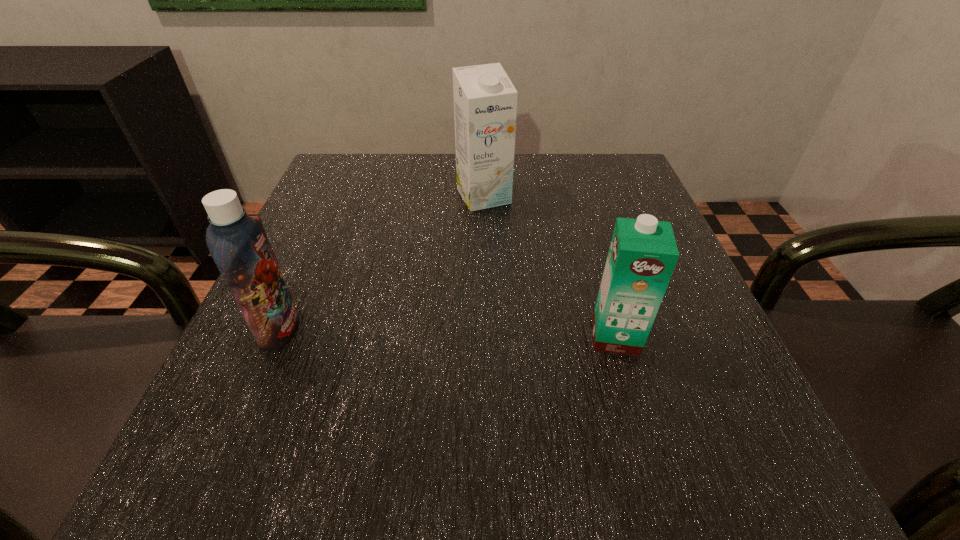
This screenshot has height=540, width=960. I want to click on vacant space that satisfies the following two spatial constraints: 1. on the front label of the leftmost object; 2. on the left side of the right carton, so [x=277, y=336].

Where is `free spot that satisfies the following two spatial constraints: 1. on the front label of the leftmost object; 2. on the back side of the shorter carton`? free spot that satisfies the following two spatial constraints: 1. on the front label of the leftmost object; 2. on the back side of the shorter carton is located at coordinates (277, 336).

Where is `free region that satisfies the following two spatial constraints: 1. on the front label of the rightmost object; 2. on the left side of the shampoo`? The width and height of the screenshot is (960, 540). free region that satisfies the following two spatial constraints: 1. on the front label of the rightmost object; 2. on the left side of the shampoo is located at coordinates (277, 336).

This screenshot has height=540, width=960. In order to click on vacant space that satisfies the following two spatial constraints: 1. on the front label of the leftmost object; 2. on the right side of the shorter carton in this screenshot , I will do `click(277, 336)`.